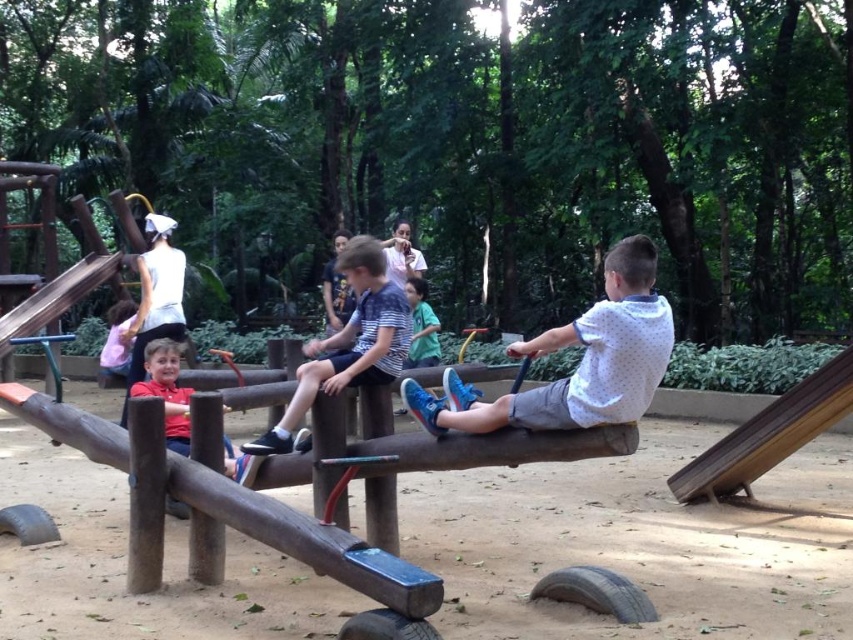
You are observing the children on the wooden seesaw at the playground. Which child is wearing a striped cotton shirt at center, and is positioned lower than the green matte shirt at center?

The striped cotton shirt at center is located below the green matte shirt at center, so the child wearing the striped cotton shirt at center is positioned lower.

You are a parent trying to locate your child wearing a white dotted shirt at center in the playground. The wooden slide at upper left is a landmark. Based on the scene description, where would you find the child relative to the slide?

The white dotted shirt at center is positioned on the right side of the wooden slide at upper left, so the child wearing the white dotted shirt at center is located to the right of the wooden slide at upper left.

You are standing at the origin point in the image. Where is the striped cotton shirt at center located in terms of coordinates?

The striped cotton shirt at center is located at coordinates (x=349, y=342).